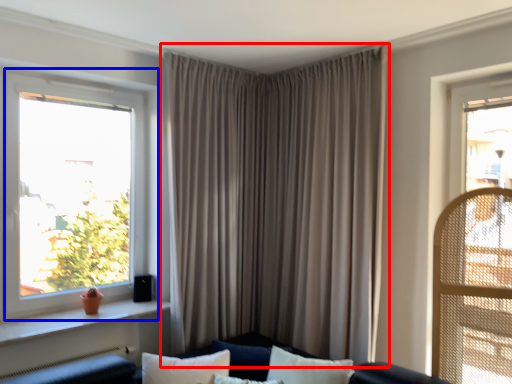
Question: Among these objects, which one is nearest to the camera, curtain (highlighted by a red box) or window (highlighted by a blue box)?

Choices:
 (A) curtain
 (B) window

Answer: (B)